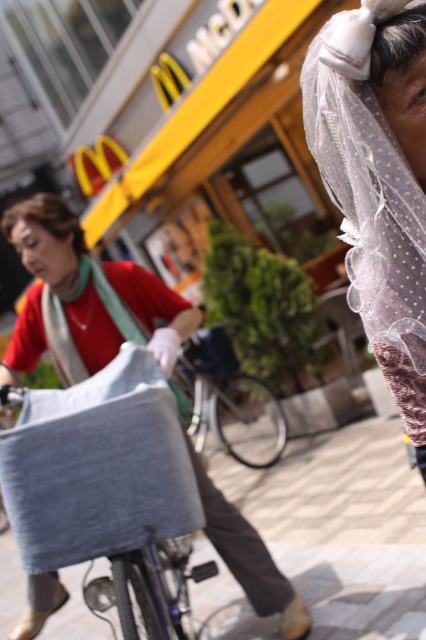
What are the coordinates of the gray fabric bag at center?

The gray fabric bag at center is located at coordinates point (97, 467).